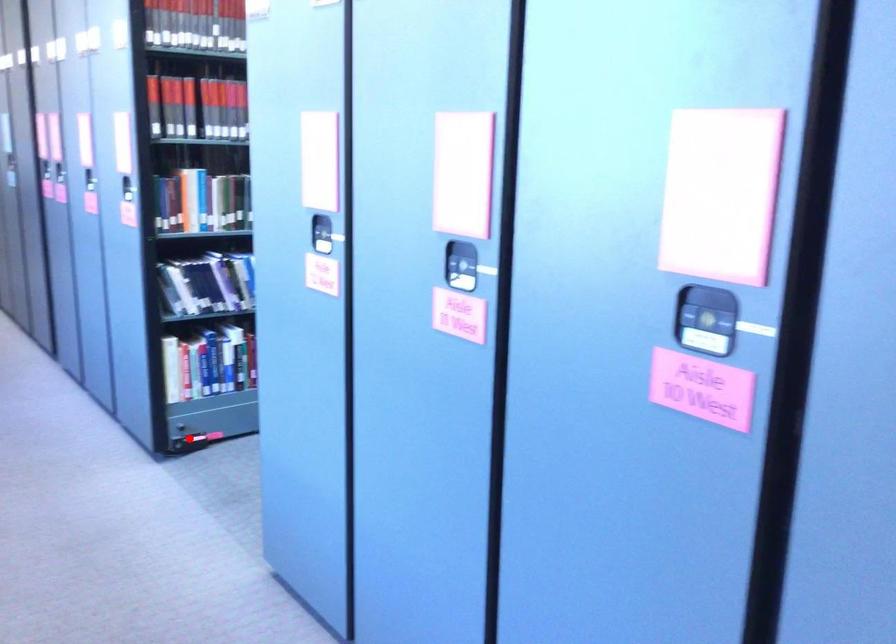
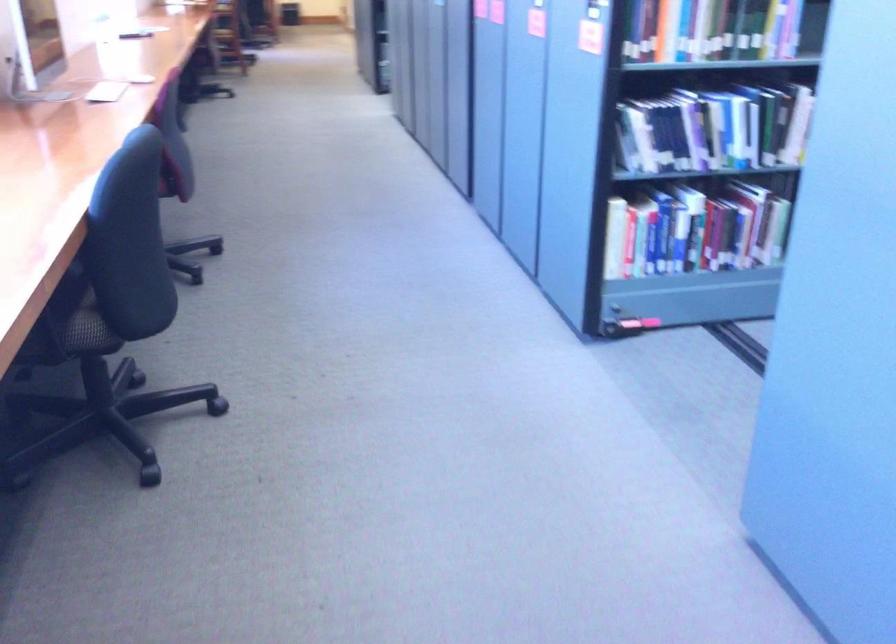
The point at the highlighted location is marked in the first image. Where is the corresponding point in the second image?

(625, 325)